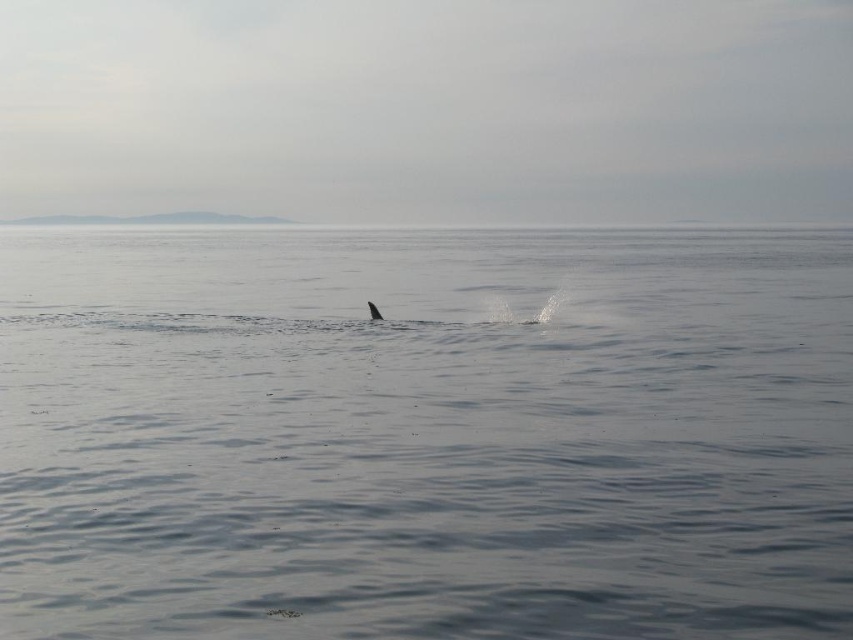
In the scene shown: Does clear water at center have a greater width compared to gray matte whale at center?

Correct, the width of clear water at center exceeds that of gray matte whale at center.

Is clear water at center thinner than gray matte whale at center?

Incorrect, clear water at center's width is not less than gray matte whale at center's.

Is point (154, 419) positioned before point (376, 320)?

Yes.

At what (x,y) coordinates should I click in order to perform the action: click on clear water at center. Please return your answer as a coordinate pair (x, y). Image resolution: width=853 pixels, height=640 pixels. Looking at the image, I should click on (425, 433).